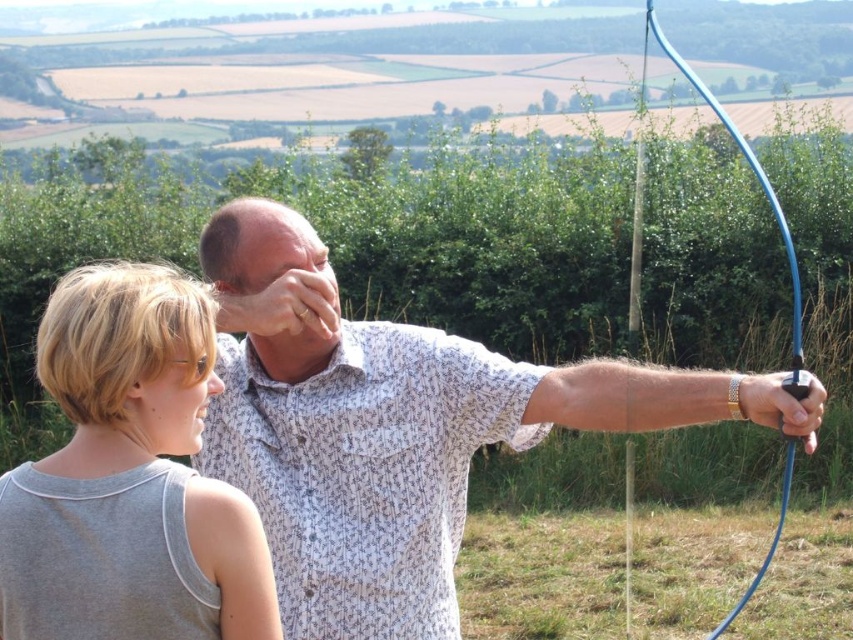
Does white printed shirt at center appear on the right side of gray fabric shirt at upper left?

Indeed, white printed shirt at center is positioned on the right side of gray fabric shirt at upper left.

Does point (305, 593) lie in front of point (267, 582)?

No, (305, 593) is further to viewer.

You are a GUI agent. You are given a task and a screenshot of the screen. Output one action in this format:
    pyautogui.click(x=<x>, y=<y>)
    Task: Click on the white printed shirt at center
    The width and height of the screenshot is (853, 640).
    Given the screenshot: What is the action you would take?
    pyautogui.click(x=397, y=428)

Is point (76, 490) more distant than point (648, 19)?

No.

Between gray fabric shirt at upper left and blue rubber bow at right, which one appears on the right side from the viewer's perspective?

blue rubber bow at right is more to the right.

Is point (61, 552) positioned before point (752, 584)?

Yes, point (61, 552) is closer to viewer.

Where is `gray fabric shirt at upper left`? The width and height of the screenshot is (853, 640). gray fabric shirt at upper left is located at coordinates (129, 477).

Does white printed shirt at center have a smaller size compared to blue rubber bow at right?

Yes, white printed shirt at center is smaller than blue rubber bow at right.

Consider the image. Is white printed shirt at center thinner than blue rubber bow at right?

Correct, white printed shirt at center's width is less than blue rubber bow at right's.

Who is more distant from viewer, (572, 374) or (792, 330)?

Point (792, 330)

Locate an element on the screen. This screenshot has width=853, height=640. white printed shirt at center is located at coordinates (397, 428).